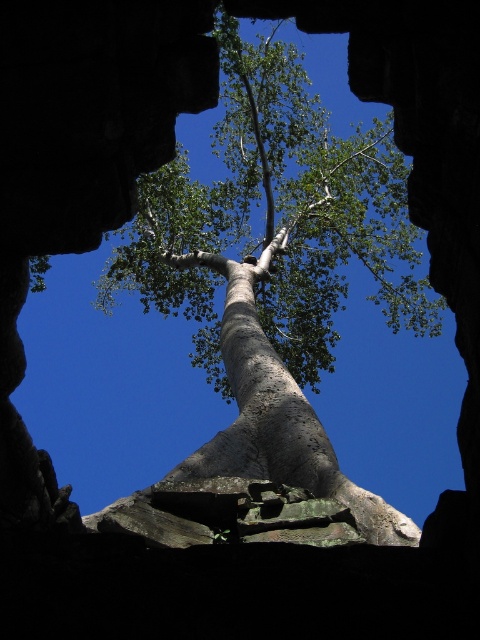
You are standing inside a stone structure and looking up at the smooth bark tree at center. If you move 0.1 units to the right along the horizontal axis, will the tree still be visible through the stone openings?

The smooth bark tree at center is located at point (276, 272). Moving 0.1 units to the right would place you at approximately 0.525 on the horizontal axis. Since the tree is centered at 0.425, moving right may position you outside the stone openings, potentially blocking the view. However, without knowing the exact dimensions of the stone openings, it is uncertain if the tree remains visible. The answer depends on the opening size and structure.

You are standing inside a stone structure and looking up at the tree. There is a point marked at coordinates [276,272]. What is the nearest object to this point?

The point at coordinates [276,272] corresponds to the smooth bark tree at center, so the nearest object to this point is the smooth bark tree at center.